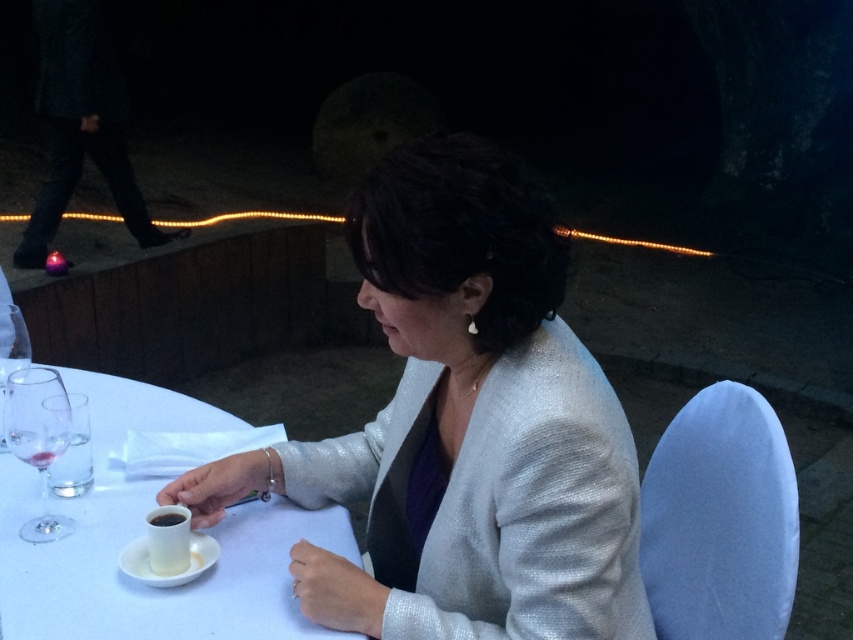
Is clear glass wine glass at lower left to the right of black glossy cup at lower left from the viewer's perspective?

Incorrect, clear glass wine glass at lower left is not on the right side of black glossy cup at lower left.

Does clear glass wine glass at lower left have a lesser height compared to black glossy cup at lower left?

No, clear glass wine glass at lower left is not shorter than black glossy cup at lower left.

Where is `clear glass wine glass at lower left`? This screenshot has height=640, width=853. clear glass wine glass at lower left is located at coordinates tap(38, 438).

Locate an element on the screen. The image size is (853, 640). clear glass wine glass at lower left is located at coordinates coord(38,438).

Based on the photo, can you confirm if shiny silver jacket at center is positioned to the right of white ceramic saucer at lower center?

Correct, you'll find shiny silver jacket at center to the right of white ceramic saucer at lower center.

Find the location of `shiny silver jacket at center`. shiny silver jacket at center is located at coordinates (463, 426).

Who is positioned more to the right, white ceramic saucer at lower center or black glossy cup at lower left?

white ceramic saucer at lower center is more to the right.

Can you confirm if white ceramic saucer at lower center is thinner than black glossy cup at lower left?

In fact, white ceramic saucer at lower center might be wider than black glossy cup at lower left.

Identify the location of white ceramic saucer at lower center. (173, 572).